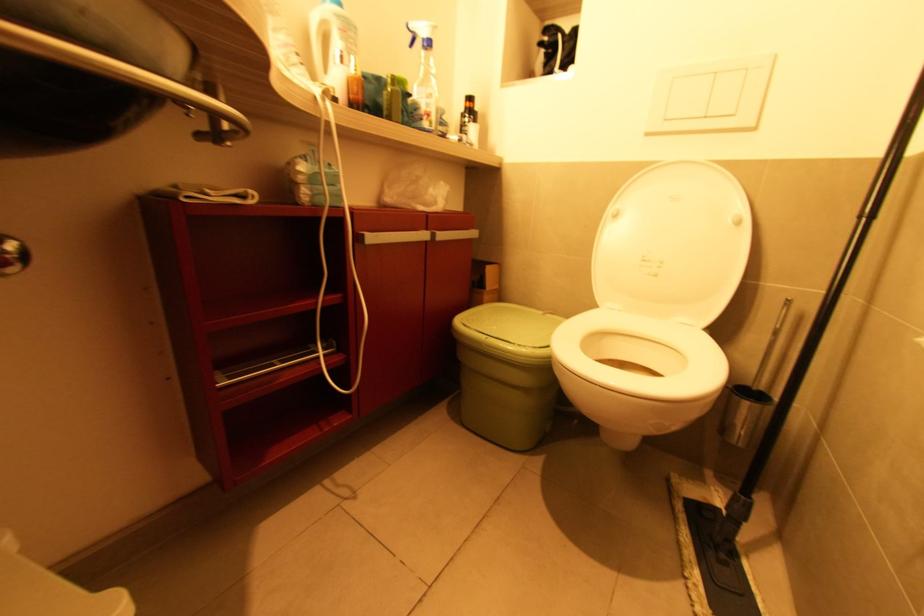
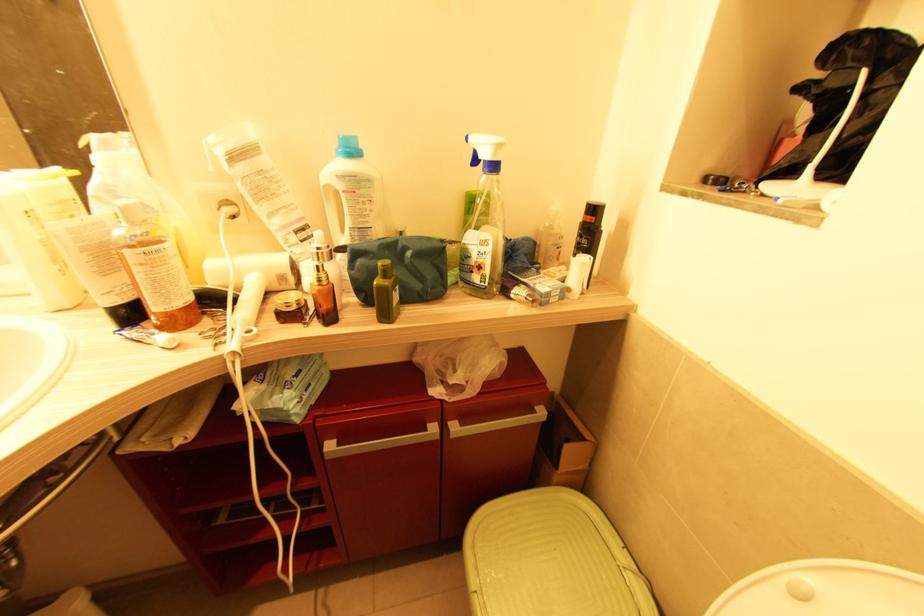
Where in the second image is the point corresponding to (545,314) from the first image?

(626, 570)